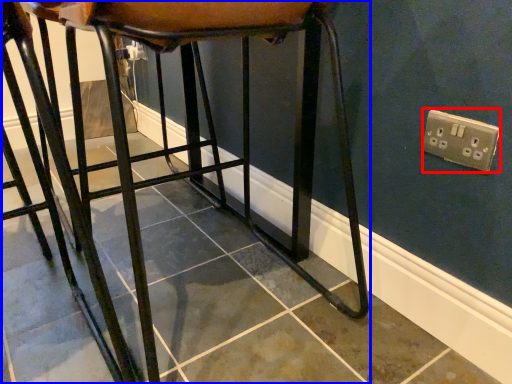
Question: Which point is further to the camera, electric outlet (highlighted by a red box) or furniture (highlighted by a blue box)?

Choices:
 (A) electric outlet
 (B) furniture

Answer: (A)